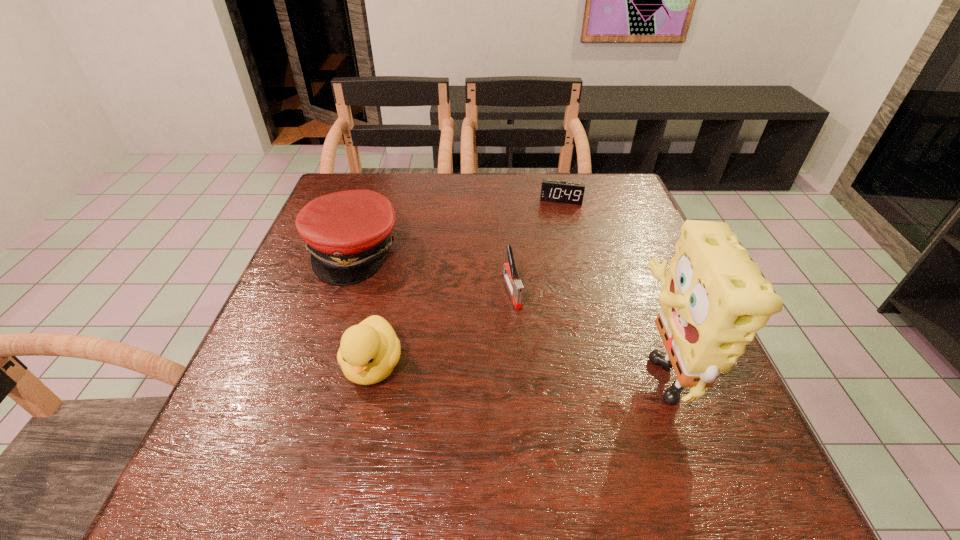
Locate an element on the screen. The width and height of the screenshot is (960, 540). duck is located at coordinates (369, 351).

Image resolution: width=960 pixels, height=540 pixels. In order to click on the tallest object in this screenshot , I will do `click(713, 300)`.

Identify the location of the third object from right to left. Image resolution: width=960 pixels, height=540 pixels. (515, 286).

Locate an element on the screen. cap is located at coordinates (347, 233).

Where is `the farthest object`? This screenshot has height=540, width=960. the farthest object is located at coordinates (557, 191).

Locate an element on the screen. This screenshot has width=960, height=540. the shortest object is located at coordinates (557, 191).

Image resolution: width=960 pixels, height=540 pixels. Identify the location of free space located 0.080m on the front-facing side of the duck. (356, 441).

Where is `free space located 0.150m on the face of the sponge`? The height and width of the screenshot is (540, 960). free space located 0.150m on the face of the sponge is located at coordinates (546, 368).

Where is `vacant space located on the face of the sponge`? vacant space located on the face of the sponge is located at coordinates (578, 368).

You are a GUI agent. You are given a task and a screenshot of the screen. Output one action in this format:
    pyautogui.click(x=<x>, y=<y>)
    Task: Click on the vacant space located 0.230m on the face of the sponge
    
    Given the screenshot: What is the action you would take?
    pyautogui.click(x=504, y=368)